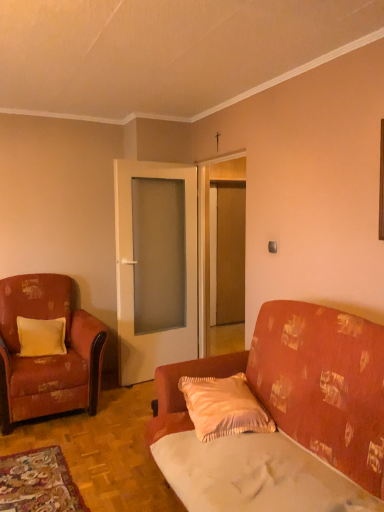
Where is `free space to the right of distressed fabric armchair at left`? This screenshot has height=512, width=384. free space to the right of distressed fabric armchair at left is located at coordinates (123, 412).